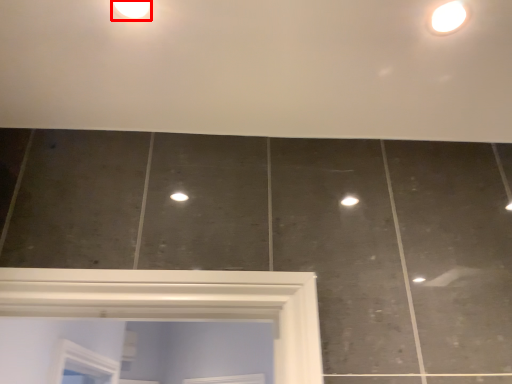
Question: From the image, what is the correct spatial relationship of droplight (annotated by the red box) in relation to light fixture?

Choices:
 (A) left
 (B) right

Answer: (A)